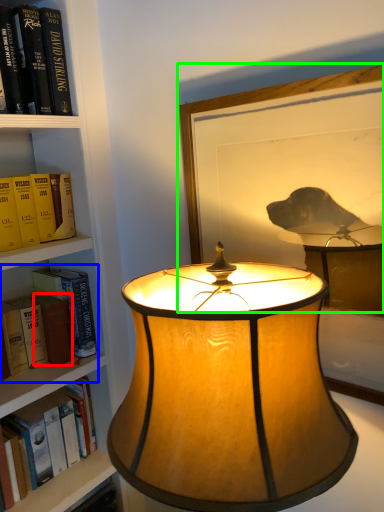
Question: Which object is the farthest from paperback book (highlighted by a red box)? Choose among these: book (highlighted by a blue box) or picture frame (highlighted by a green box).

Choices:
 (A) book
 (B) picture frame

Answer: (B)